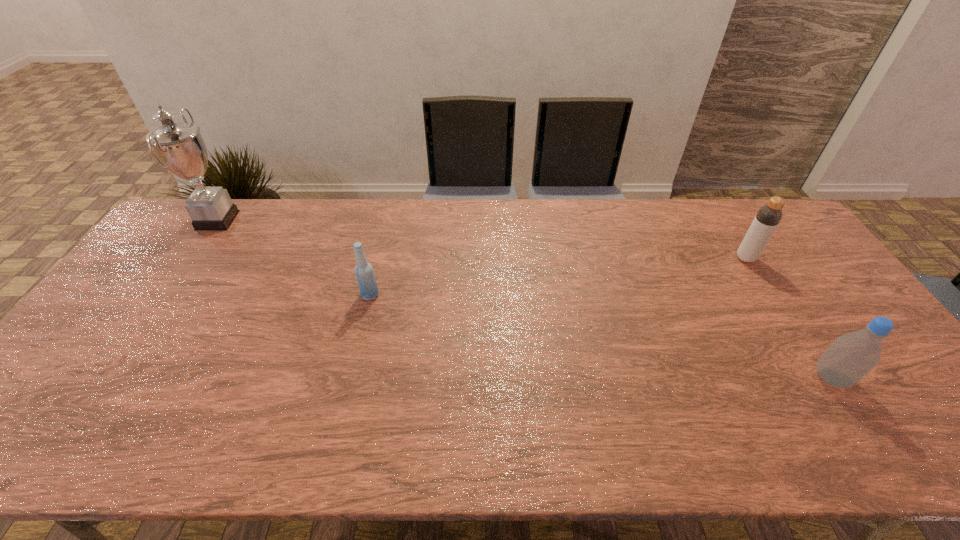
At what (x,y) coordinates should I click in order to perform the action: click on object present at the far edge. Please return your answer as a coordinate pair (x, y). This screenshot has height=540, width=960. Looking at the image, I should click on (181, 150).

Find the location of a particular element. The height and width of the screenshot is (540, 960). object present at the left edge is located at coordinates (181, 150).

Find the location of a particular element. Image resolution: width=960 pixels, height=540 pixels. object situated at the right edge is located at coordinates point(851,356).

Where is `object that is at the far left corner`? object that is at the far left corner is located at coordinates (181, 150).

Image resolution: width=960 pixels, height=540 pixels. What are the coordinates of `vacant space at the far edge of the desktop` in the screenshot? It's located at (677, 202).

In the image, there is a desktop. Identify the location of vacant space at the left edge. (170, 255).

This screenshot has height=540, width=960. In the image, there is a desktop. Identify the location of vacant region at the right edge. (813, 278).

Identify the location of vacant space at the far left corner. (175, 233).

Where is `empty space that is in between the trophy cup and the farthest bottle`? The height and width of the screenshot is (540, 960). empty space that is in between the trophy cup and the farthest bottle is located at coordinates (482, 239).

This screenshot has height=540, width=960. Identify the location of free area in between the trophy cup and the nearest bottle. (524, 299).